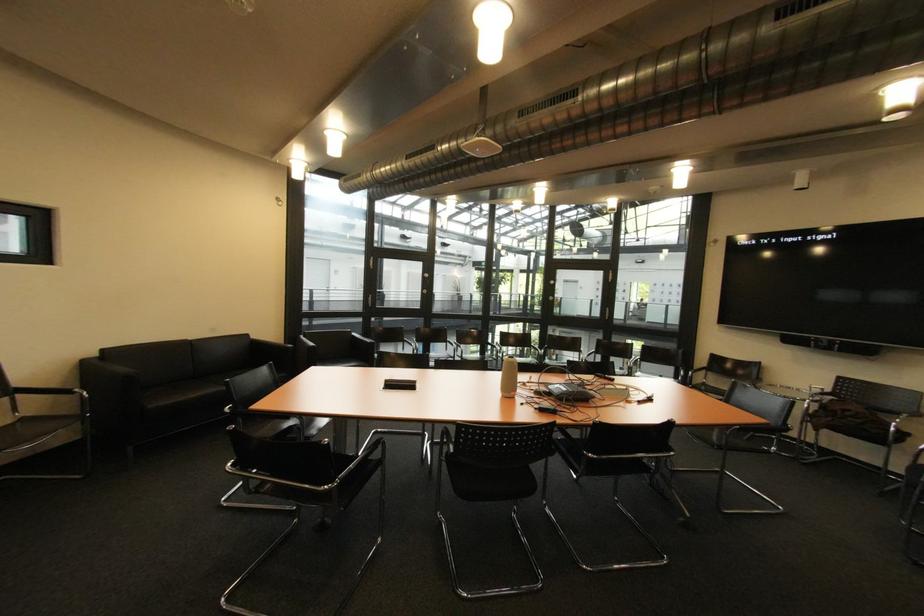
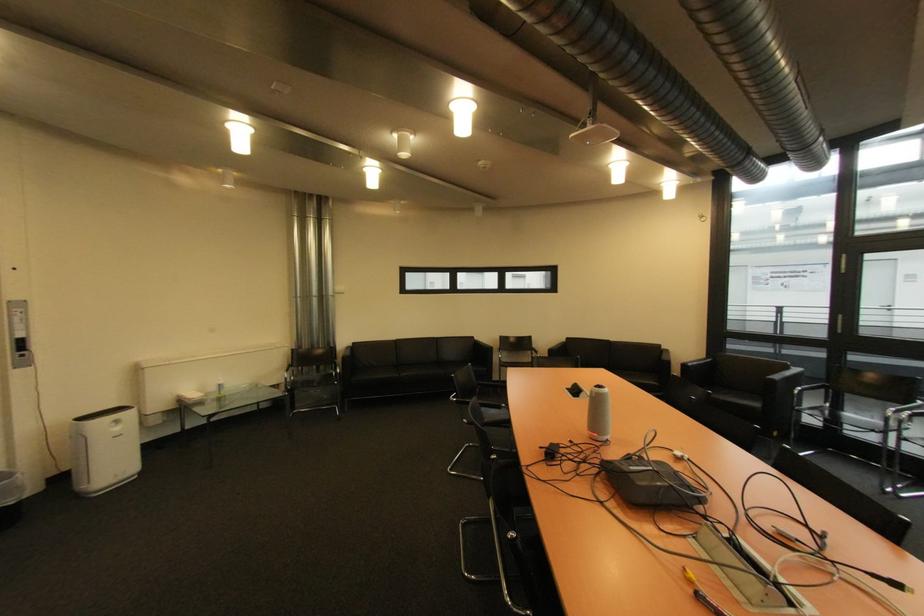
Where in the second image is the point corresponding to point 391,387 from the first image?

(578, 389)